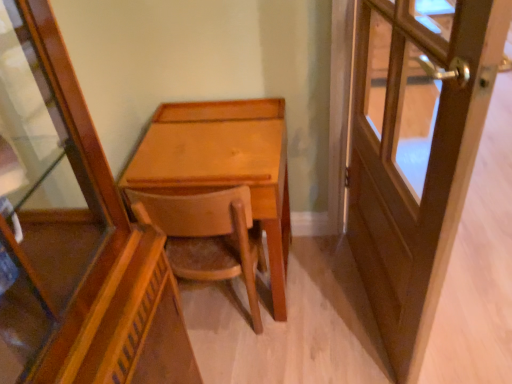
Locate an element on the screen. The image size is (512, 384). vacant space situated above light brown wood desk at center (from a real-world perspective) is located at coordinates (223, 129).